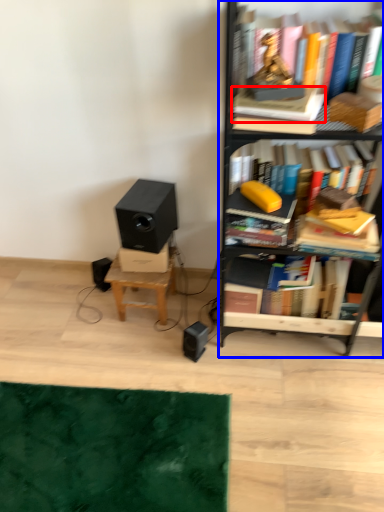
Question: Which point is closer to the camera, paperback book (highlighted by a red box) or bookcase (highlighted by a blue box)?

Choices:
 (A) paperback book
 (B) bookcase

Answer: (B)